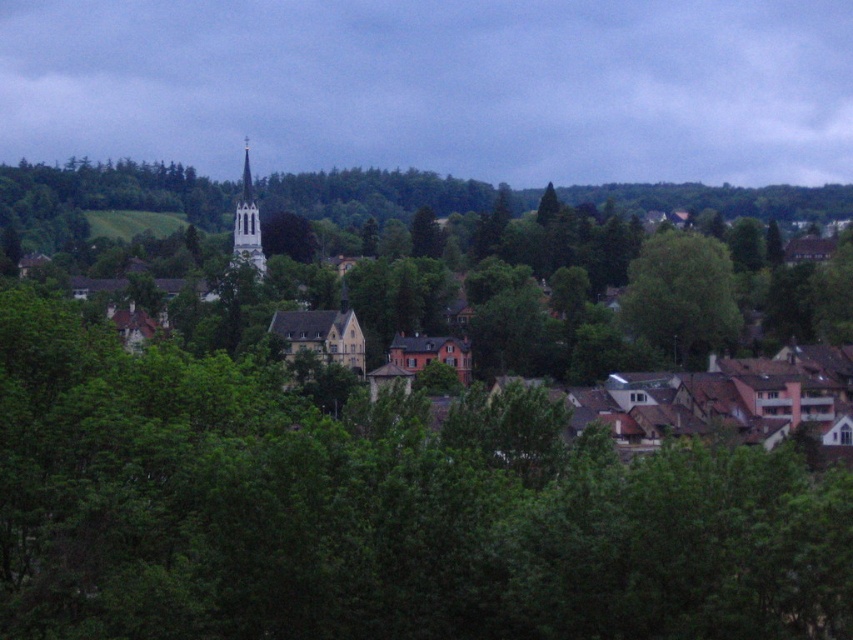
Measure the distance from green leafy tree at center to smooth white steeple at center.

They are 49.73 meters apart.

The height and width of the screenshot is (640, 853). What do you see at coordinates (680, 298) in the screenshot? I see `green leafy tree at center` at bounding box center [680, 298].

Identify the location of green leafy tree at center. The width and height of the screenshot is (853, 640). (680, 298).